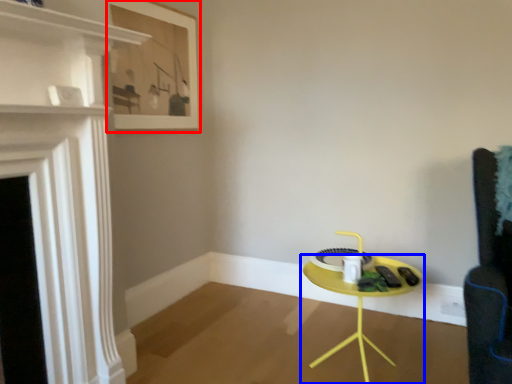
Question: Which of the following is the closest to the observer, picture frame (highlighted by a red box) or table (highlighted by a blue box)?

Choices:
 (A) picture frame
 (B) table

Answer: (B)